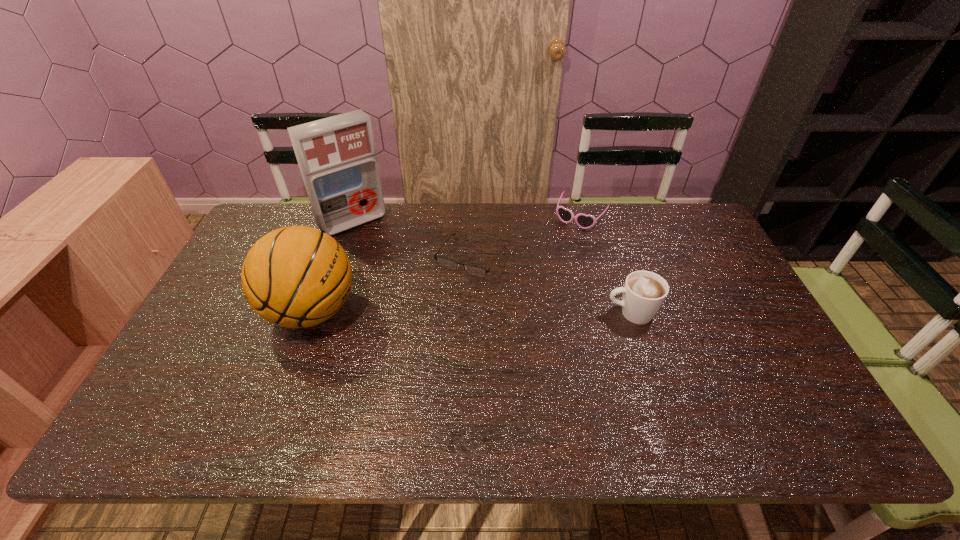
Locate an element on the screen. The height and width of the screenshot is (540, 960). free location that satisfies the following two spatial constraints: 1. on the front side of the third object from right to left; 2. with the handle on the side of the third tallest object is located at coordinates (469, 313).